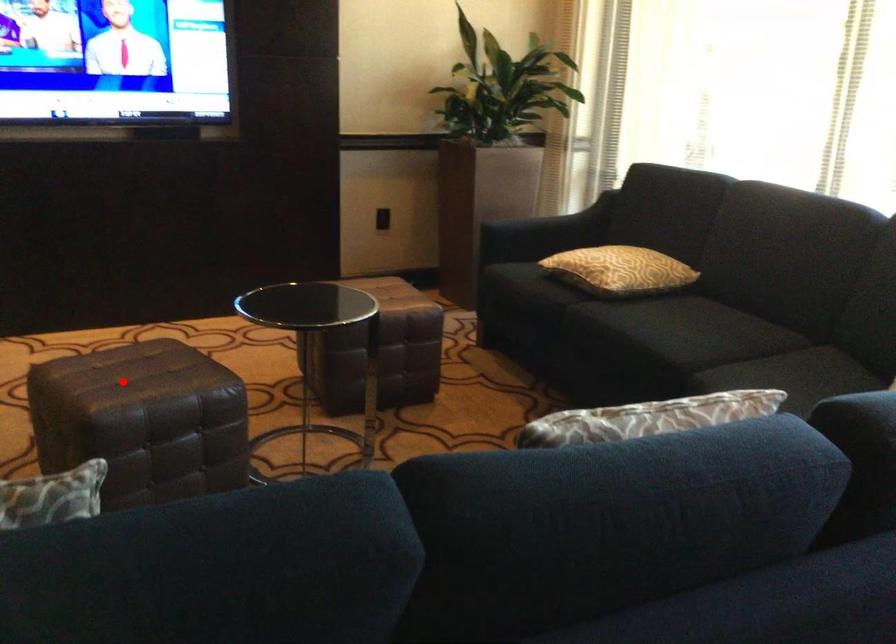
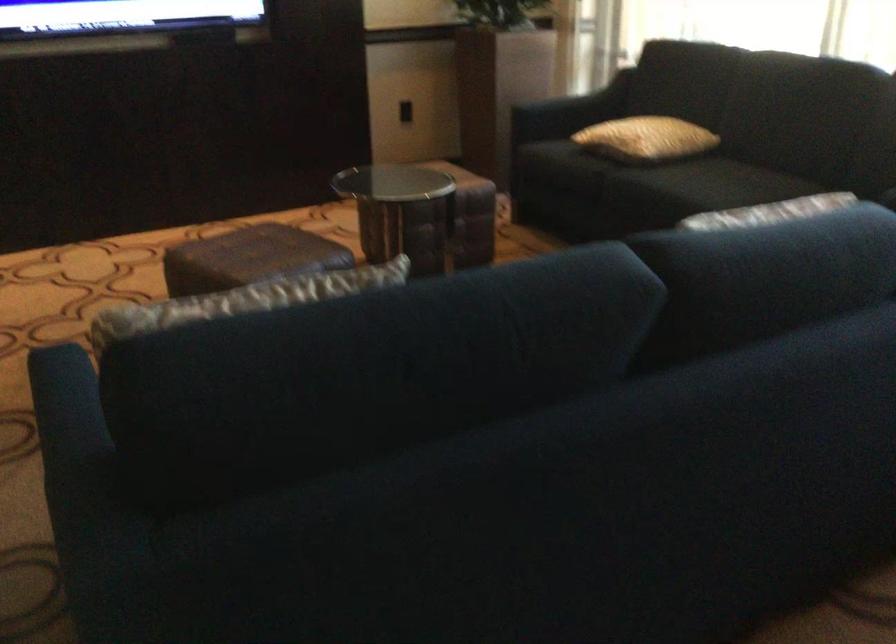
Question: I am providing you with two images of the same scene from different viewpoints. Image1 has a red point marked. In image2, the corresponding 3D location appears at what relative position? Reply with the corresponding letter.

Choices:
 (A) Closer
 (B) Farther

Answer: (B)